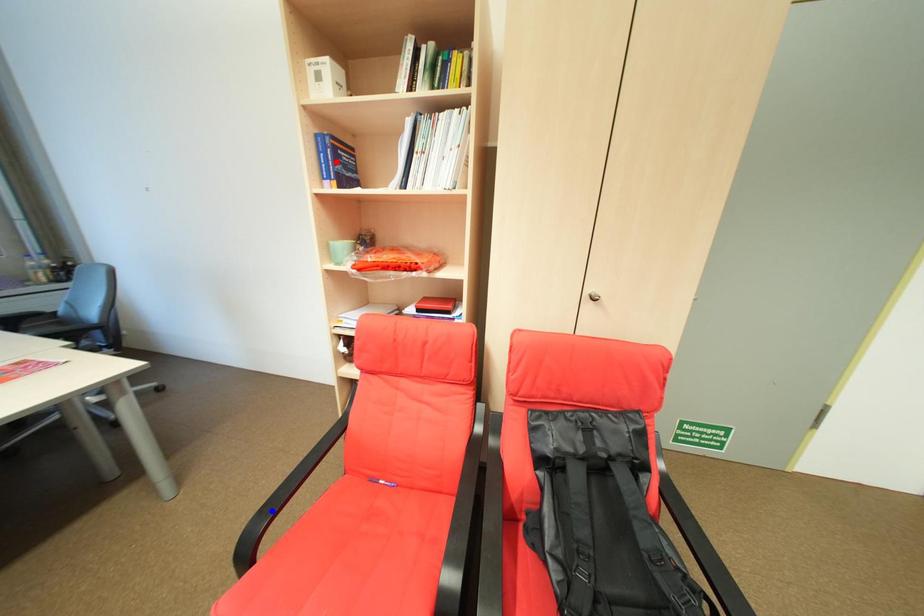
Question: In the image, two points are highlighted. Which point is nearer to the camera? Reply with the corresponding letter.

Choices:
 (A) blue point
 (B) red point

Answer: (A)